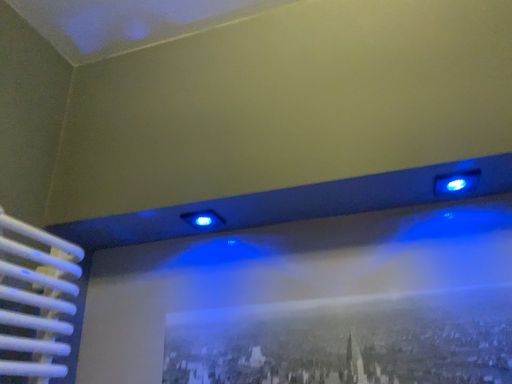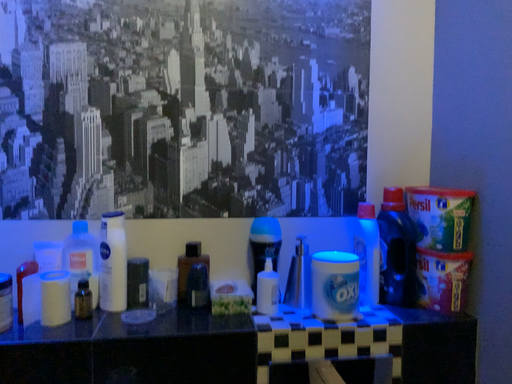
Question: Which way did the camera rotate in the video?

Choices:
 (A) rotated upward
 (B) rotated downward

Answer: (B)